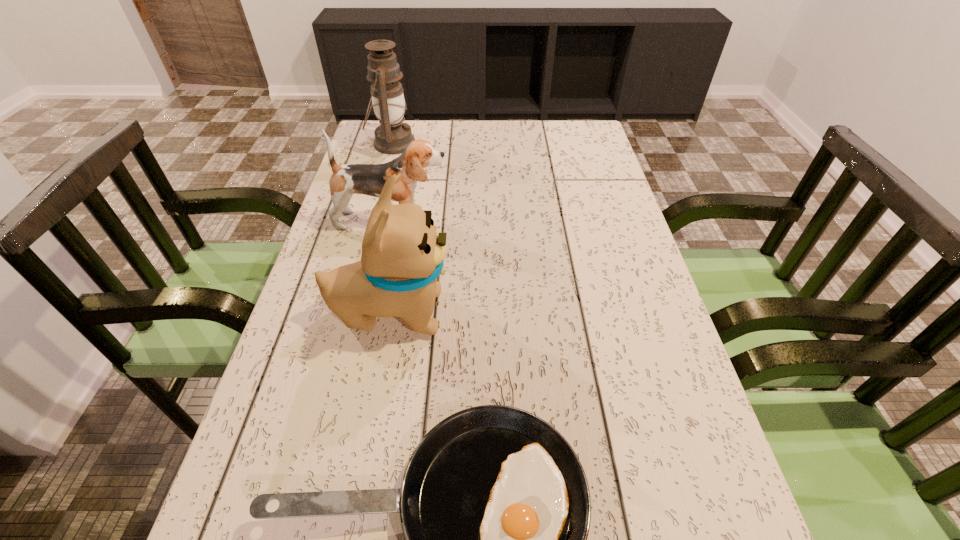
Where is `the farthest object`? The image size is (960, 540). the farthest object is located at coordinates (393, 136).

At what (x,y) coordinates should I click in order to perform the action: click on the second nearest object. Please return your answer as a coordinate pair (x, y). The height and width of the screenshot is (540, 960). Looking at the image, I should click on click(x=402, y=255).

Image resolution: width=960 pixels, height=540 pixels. I want to click on the taller puppy, so click(x=402, y=255).

This screenshot has height=540, width=960. I want to click on the shorter puppy, so click(x=369, y=179).

I want to click on the farther puppy, so click(x=369, y=179).

Find the location of a particular element. This screenshot has height=540, width=960. vacant space situated 0.190m on the front of the farthest object is located at coordinates (378, 196).

This screenshot has height=540, width=960. What are the coordinates of `free space located 0.320m on the face of the nearer puppy` in the screenshot? It's located at (597, 312).

I want to click on vacant space located at the face of the third nearest object, so click(545, 220).

This screenshot has width=960, height=540. I want to click on object that is at the far edge, so click(393, 136).

Find the location of `oil lamp located in the left edge section of the desktop`. oil lamp located in the left edge section of the desktop is located at coordinates (393, 136).